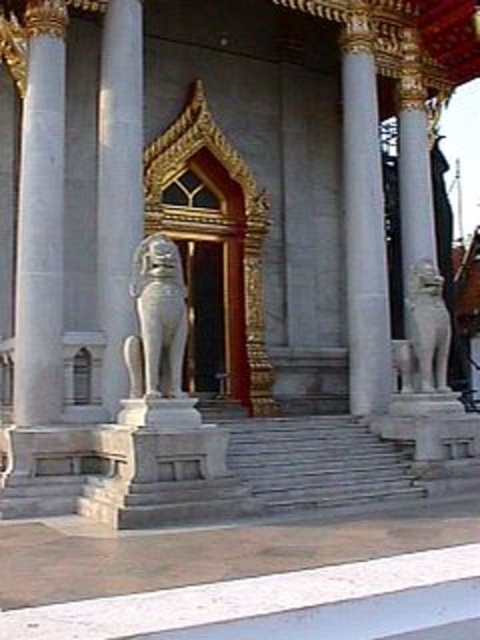
You are an architect inspecting the entrance of a temple. You notice two lion statues guarding the entrance. The white marble lion at left and the white stone lion at right. Based on their sizes, which one is more likely made of marble?

The white marble lion at left is more likely made of marble because it has a larger width than the white stone lion at right, and marble typically allows for larger sculptures due to its durability and workability.

You are a maintenance worker needing to reach the white marble column at center and the white stone lion at right with a ladder that is 4 meters long. Can you safely reach both objects with the ladder as it is?

The distance between the white marble column at center and the white stone lion at right is 4.46 meters, so the ladder is 0.46 meters shorter than needed. You cannot safely reach both objects with the ladder as it is.

You are an architect designing a new temple entrance. You need to place a white marble pillar at right and a white marble lion at left in the design. According to the scene, which object should be placed on the right side of the other?

The white marble pillar at right should be placed on the right side of the white marble lion at left because the description states that the white marble pillar at right is positioned on the right side of the white marble lion at left.